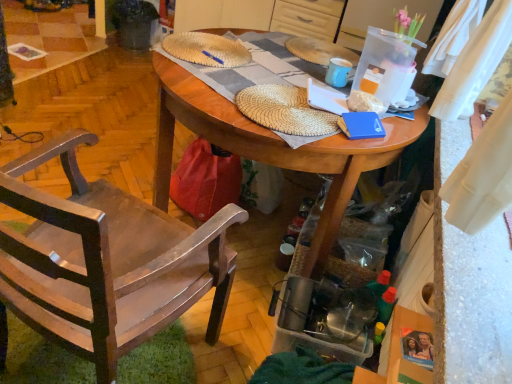
This screenshot has width=512, height=384. Identify the location of free area in between blue plastic pen at center and woven straw hat at center, the first hat when ordered from front to back. (232, 71).